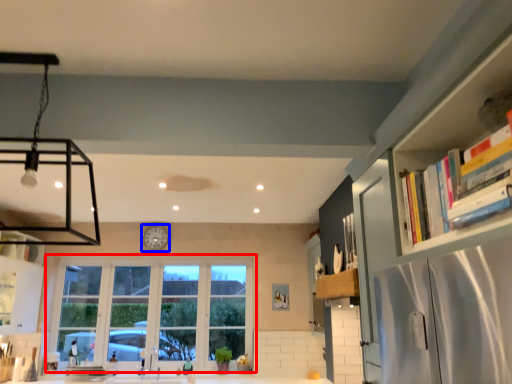
Question: Which point is further to the camera, window (highlighted by a red box) or clock (highlighted by a blue box)?

Choices:
 (A) window
 (B) clock

Answer: (B)